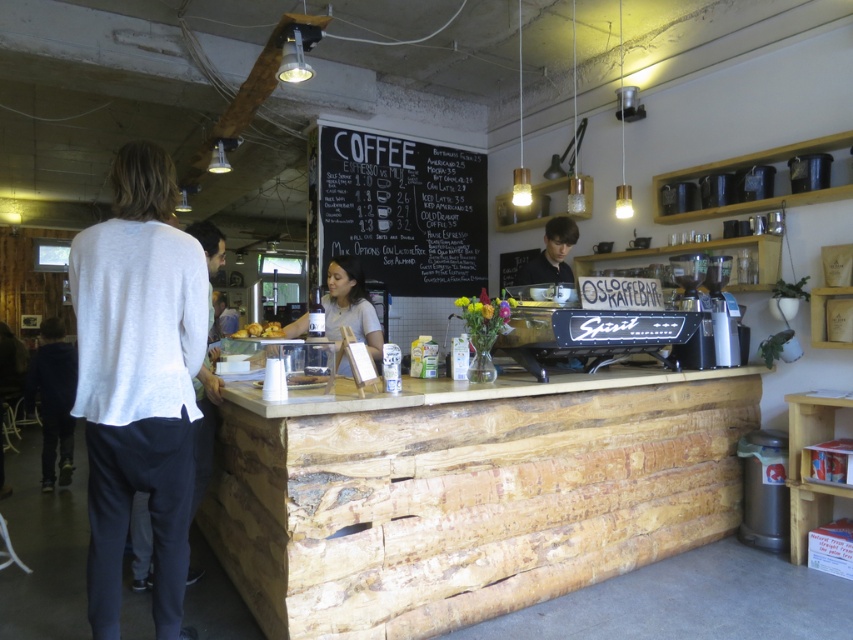
You are a barista working at Osloffekaffebar. You need to place a new menu board on the counter so that it doesn not block the coffee machine. Where should you place it in relation to the white cotton sweater at left and the matte black wine bottle at center?

The white cotton sweater at left is positioned under the matte black wine bottle at center. To avoid blocking the coffee machine, place the menu board to the right of the matte black wine bottle at center, ensuring it doesn not interfere with the coffee machine area.